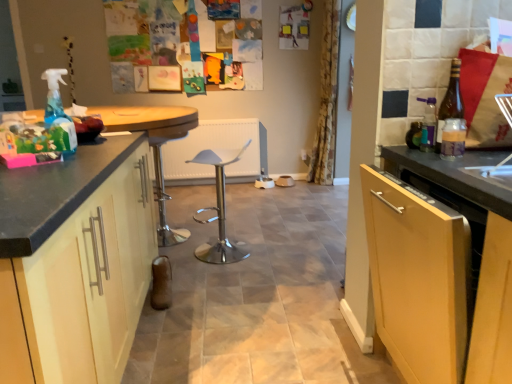
You are a GUI agent. You are given a task and a screenshot of the screen. Output one action in this format:
    pyautogui.click(x=<x>, y=<y>)
    Task: Click on the empty space that is in between yellow floral fabric curtain at center and polished silver bar stool at center, acting as the 2th bar stool starting from the left
    The width and height of the screenshot is (512, 384).
    Given the screenshot: What is the action you would take?
    pyautogui.click(x=276, y=213)